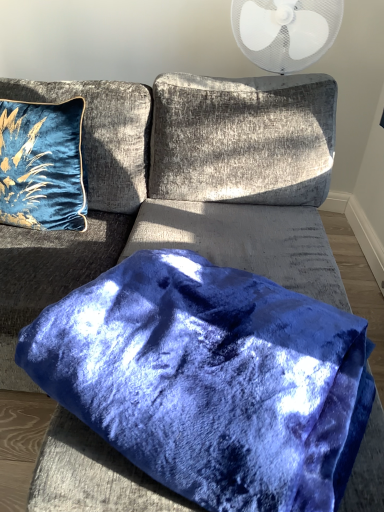
The image size is (384, 512). Find the location of `velvet blue pillow at upper left, which appears as the second pillow when ordered from the bottom`. velvet blue pillow at upper left, which appears as the second pillow when ordered from the bottom is located at coordinates (42, 165).

The width and height of the screenshot is (384, 512). Describe the element at coordinates (210, 380) in the screenshot. I see `velvet blue pillow at center, acting as the second pillow starting from the left` at that location.

You are a GUI agent. You are given a task and a screenshot of the screen. Output one action in this format:
    pyautogui.click(x=<x>, y=<y>)
    Task: Click on the velvet blue pillow at center, acting as the second pillow starting from the left
    
    Given the screenshot: What is the action you would take?
    pyautogui.click(x=210, y=380)

The height and width of the screenshot is (512, 384). In order to click on velvet blue pillow at upper left, arranged as the 1th pillow when viewed from the left in this screenshot , I will do (x=42, y=165).

Locate an element on the screen. Image resolution: width=384 pixels, height=512 pixels. couch below the velvet blue pillow at upper left, the second pillow viewed from the right (from a real-world perspective) is located at coordinates (x=239, y=177).

From a real-world perspective, is velvet blue couch at center above or below velvet blue pillow at upper left, arranged as the 1th pillow when viewed from the left?

From a real-world perspective, velvet blue couch at center is physically below velvet blue pillow at upper left, arranged as the 1th pillow when viewed from the left.

How different are the orientations of velvet blue couch at center and velvet blue pillow at upper left, the second pillow viewed from the right, in degrees?

The angular difference between velvet blue couch at center and velvet blue pillow at upper left, the second pillow viewed from the right, is 7.87 degrees.

Considering the positions of objects velvet blue pillow at center, acting as the second pillow starting from the left, and velvet blue pillow at upper left, the 2th pillow from the front, in the image provided, who is more to the left, velvet blue pillow at center, acting as the second pillow starting from the left, or velvet blue pillow at upper left, the 2th pillow from the front,?

Positioned to the left is velvet blue pillow at upper left, the 2th pillow from the front.

Could you tell me if velvet blue pillow at center, which is counted as the first pillow, starting from the bottom, is facing velvet blue pillow at upper left, arranged as the 1th pillow when viewed from the left?

No, velvet blue pillow at center, which is counted as the first pillow, starting from the bottom, is not facing towards velvet blue pillow at upper left, arranged as the 1th pillow when viewed from the left.

Is velvet blue pillow at center, the first pillow from the front, in contact with velvet blue pillow at upper left, which appears as the first pillow when viewed from the back?

velvet blue pillow at center, the first pillow from the front, and velvet blue pillow at upper left, which appears as the first pillow when viewed from the back, are not in contact.

How far apart are velvet blue pillow at center, arranged as the first pillow when viewed from the right, and velvet blue pillow at upper left, the 2th pillow from the front?

30.03 inches.

Would you consider velvet blue couch at center to be distant from velvet blue pillow at center, acting as the second pillow starting from the left?

No.

Between velvet blue couch at center and velvet blue pillow at center, which is counted as the first pillow, starting from the bottom, which one is positioned behind?

Positioned behind is velvet blue pillow at center, which is counted as the first pillow, starting from the bottom.

How many degrees apart are the facing directions of velvet blue couch at center and velvet blue pillow at center, arranged as the 2th pillow when viewed from the top?

The angle between the facing direction of velvet blue couch at center and the facing direction of velvet blue pillow at center, arranged as the 2th pillow when viewed from the top, is 24.4 degrees.

In the scene shown: Considering the relative positions of velvet blue couch at center and velvet blue pillow at center, acting as the second pillow starting from the left, in the image provided, is velvet blue couch at center to the left or to the right of velvet blue pillow at center, acting as the second pillow starting from the left,?

Clearly, velvet blue couch at center is on the left of velvet blue pillow at center, acting as the second pillow starting from the left, in the image.

Is velvet blue pillow at upper left, arranged as the 1th pillow when viewed from the left, behind velvet blue couch at center?

That is True.

Looking at the image, does velvet blue pillow at upper left, which appears as the second pillow when ordered from the bottom, seem bigger or smaller compared to velvet blue couch at center?

velvet blue pillow at upper left, which appears as the second pillow when ordered from the bottom, is smaller than velvet blue couch at center.

From a real-world perspective, is velvet blue pillow at upper left, which appears as the second pillow when ordered from the bottom, physically below velvet blue couch at center?

No, from a real-world perspective, velvet blue pillow at upper left, which appears as the second pillow when ordered from the bottom, is not below velvet blue couch at center.

Which point is more forward, (x=18, y=164) or (x=190, y=165)?

The point (x=18, y=164) is closer to the camera.

Looking at this image, considering the relative sizes of velvet blue pillow at upper left, arranged as the 1th pillow when viewed from the left, and velvet blue pillow at center, which is counted as the first pillow, starting from the bottom, in the image provided, is velvet blue pillow at upper left, arranged as the 1th pillow when viewed from the left, smaller than velvet blue pillow at center, which is counted as the first pillow, starting from the bottom,?

Indeed, velvet blue pillow at upper left, arranged as the 1th pillow when viewed from the left, has a smaller size compared to velvet blue pillow at center, which is counted as the first pillow, starting from the bottom.

Image resolution: width=384 pixels, height=512 pixels. Find the location of `pillow located above the velvet blue pillow at center, arranged as the first pillow when viewed from the right (from a real-world perspective)`. pillow located above the velvet blue pillow at center, arranged as the first pillow when viewed from the right (from a real-world perspective) is located at coordinates (42, 165).

How many degrees apart are the facing directions of velvet blue pillow at upper left, which appears as the second pillow when ordered from the bottom, and velvet blue pillow at center, arranged as the 2th pillow when viewed from the top?

The angular difference between velvet blue pillow at upper left, which appears as the second pillow when ordered from the bottom, and velvet blue pillow at center, arranged as the 2th pillow when viewed from the top, is 16.5 degrees.

From the picture: Does velvet blue pillow at upper left, which appears as the first pillow when viewed from the back, have a lesser width compared to velvet blue pillow at center, which is counted as the first pillow, starting from the bottom?

Yes.

Is velvet blue pillow at center, arranged as the 2th pillow when viewed from the top, oriented away from velvet blue couch at center?

Correct, velvet blue pillow at center, arranged as the 2th pillow when viewed from the top, is looking away from velvet blue couch at center.

From the image's perspective, is velvet blue pillow at center, which is counted as the first pillow, starting from the bottom, over velvet blue couch at center?

No.

Can we say velvet blue pillow at center, acting as the second pillow starting from the left, lies outside velvet blue couch at center?

No, most part of velvet blue pillow at center, acting as the second pillow starting from the left, lies within velvet blue couch at center.

Identify the location of pillow above the velvet blue couch at center (from the image's perspective). (42, 165).

Find the location of a particular element. The image size is (384, 512). pillow above the velvet blue pillow at center, the first pillow from the front (from a real-world perspective) is located at coordinates (42, 165).

Which object lies nearer to the anchor point velvet blue couch at center, velvet blue pillow at center, the second pillow from the back, or velvet blue pillow at upper left, the second pillow viewed from the right?

The object closer to velvet blue couch at center is velvet blue pillow at upper left, the second pillow viewed from the right.

From the image, which object appears to be farther from velvet blue pillow at center, the first pillow from the front, velvet blue couch at center or velvet blue pillow at upper left, the second pillow viewed from the right?

Based on the image, velvet blue pillow at upper left, the second pillow viewed from the right, appears to be further to velvet blue pillow at center, the first pillow from the front.

Based on their spatial positions, is velvet blue pillow at upper left, acting as the first pillow starting from the top, or velvet blue couch at center closer to velvet blue pillow at center, the first pillow from the front?

velvet blue couch at center is closer to velvet blue pillow at center, the first pillow from the front.

Which object lies nearer to the anchor point velvet blue couch at center, velvet blue pillow at upper left, acting as the first pillow starting from the top, or velvet blue pillow at center, acting as the second pillow starting from the left?

velvet blue pillow at upper left, acting as the first pillow starting from the top.

Looking at the image, which one is located further to velvet blue pillow at upper left, acting as the first pillow starting from the top, velvet blue pillow at center, arranged as the first pillow when viewed from the right, or velvet blue couch at center?

velvet blue pillow at center, arranged as the first pillow when viewed from the right.

Estimate the real-world distances between objects in this image. Which object is further from velvet blue pillow at upper left, acting as the first pillow starting from the top, velvet blue couch at center or velvet blue pillow at center, the first pillow from the front?

velvet blue pillow at center, the first pillow from the front.

Find the location of `pillow between velvet blue couch at center and velvet blue pillow at upper left, the second pillow viewed from the right, in the front-back direction`. pillow between velvet blue couch at center and velvet blue pillow at upper left, the second pillow viewed from the right, in the front-back direction is located at coordinates (210, 380).